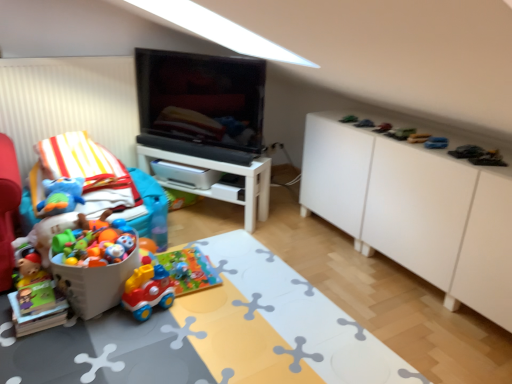
You are a GUI agent. You are given a task and a screenshot of the screen. Output one action in this format:
    pyautogui.click(x=<x>, y=<y>)
    Task: Click on the unoccupied region to the right of rubberized plastic train at center, which appears as the 3th toy when viewed from the left
    
    Given the screenshot: What is the action you would take?
    pyautogui.click(x=193, y=302)